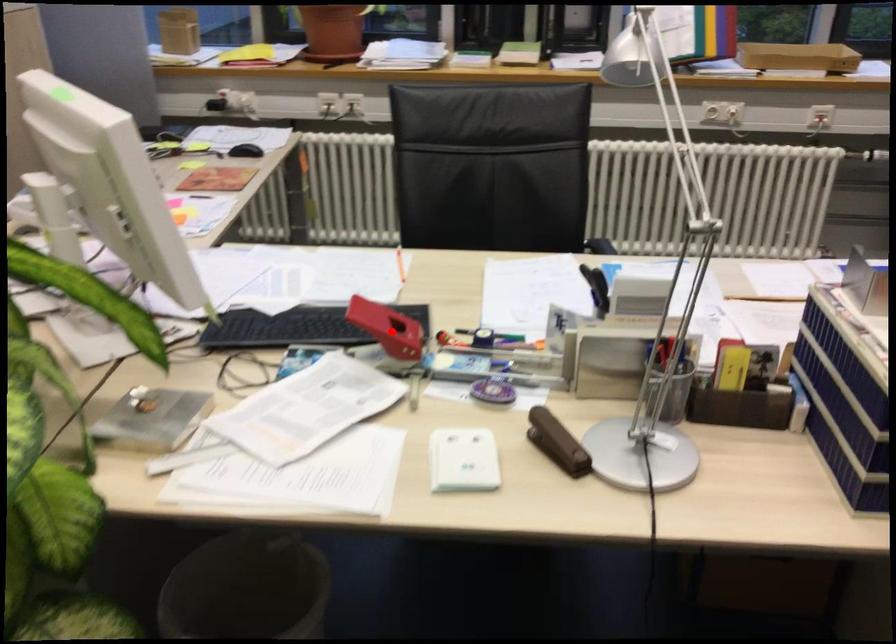
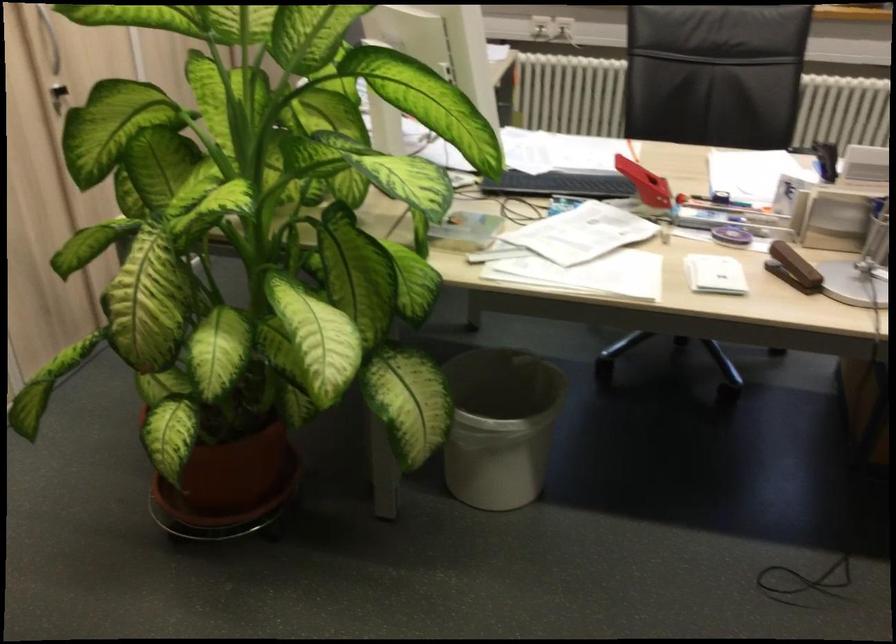
Question: I am providing you with two images of the same scene from different viewpoints. A red point is marked on the first image. Can you still see the location of the red point in image 2?

Choices:
 (A) Yes
 (B) No

Answer: (A)